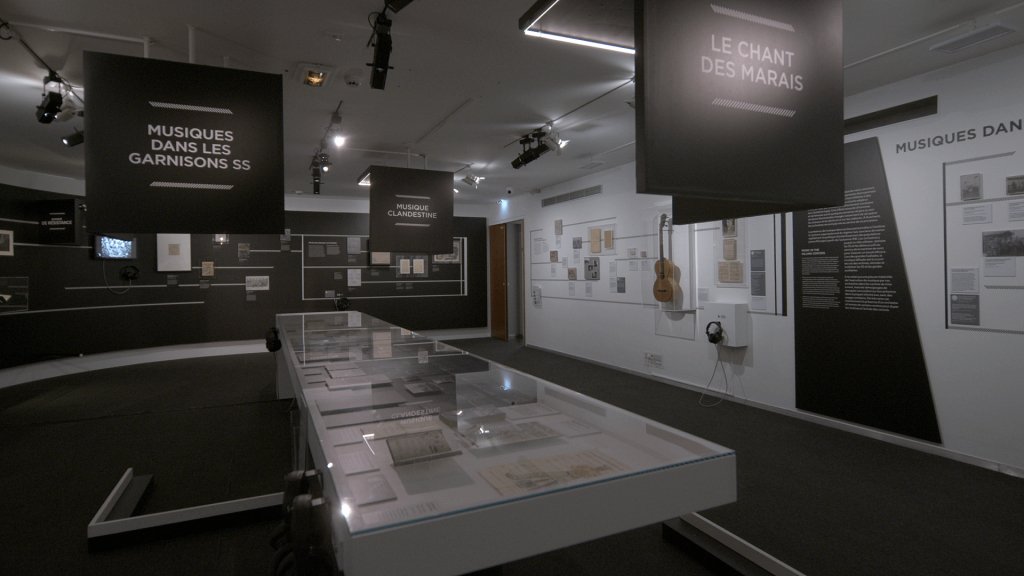
At what (x,y) coordinates should I click in order to perform the action: click on cord. Please return your answer as a coordinate pair (x, y). The height and width of the screenshot is (576, 1024). Looking at the image, I should click on (725, 374).